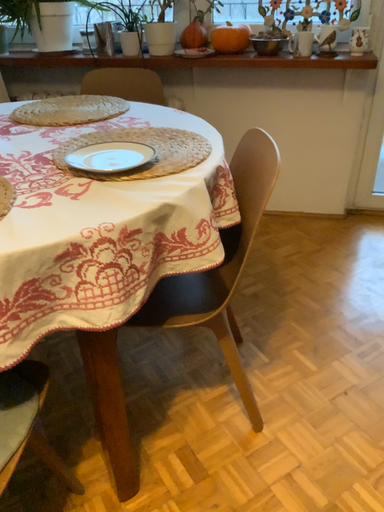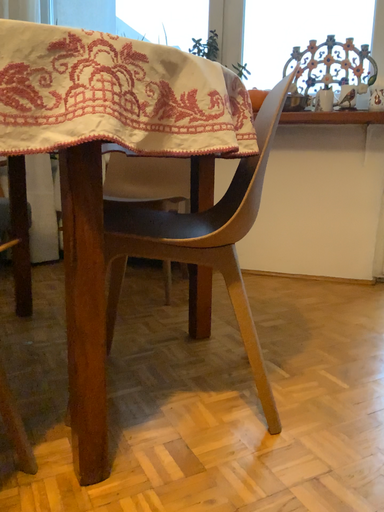
Question: Which way did the camera rotate in the video?

Choices:
 (A) rotated downward
 (B) rotated upward

Answer: (B)